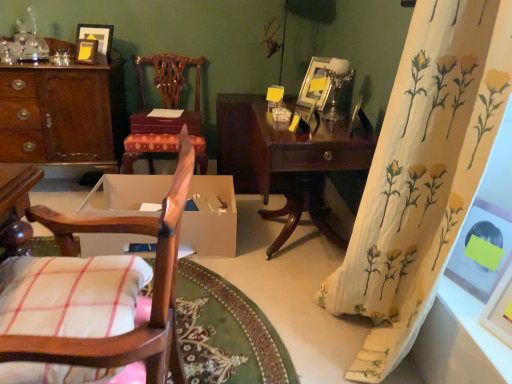
This screenshot has height=384, width=512. Describe the element at coordinates (71, 295) in the screenshot. I see `white cotton pillow at lower left` at that location.

In order to face wooden picture frame at upper left, which is the 2th picture frame from top to bottom, should I rotate leftwards or rightwards?

You should rotate left by 21.160 degrees.

This screenshot has width=512, height=384. I want to click on white cotton pillow at lower left, so click(71, 295).

Does point (74, 292) lie behind point (288, 188)?

That is False.

In the scene shown: Are white cotton pillow at lower left and mahogany wood table at center located far from each other?

Yes, white cotton pillow at lower left and mahogany wood table at center are quite far apart.

Would you say white cotton pillow at lower left is outside mahogany wood table at center?

Indeed, white cotton pillow at lower left is completely outside mahogany wood table at center.

You are a GUI agent. You are given a task and a screenshot of the screen. Output one action in this format:
    pyautogui.click(x=<x>, y=<y>)
    Task: Click on the table below the white cotton pillow at lower left (from a real-world perspective)
    The height and width of the screenshot is (384, 512).
    Given the screenshot: What is the action you would take?
    pyautogui.click(x=286, y=160)

Does mahogany wood table at center turn towards wooden chair with carved backrest at center, acting as the first chair starting from the top?

Yes, mahogany wood table at center is aimed at wooden chair with carved backrest at center, acting as the first chair starting from the top.

Is there a large distance between mahogany wood table at center and wooden chair with carved backrest at center, which ranks as the second chair in front-to-back order?

No, mahogany wood table at center is not far from wooden chair with carved backrest at center, which ranks as the second chair in front-to-back order.

From the picture: Which point is more forward, (296, 136) or (160, 88)?

The point (296, 136) is in front.

How different are the orientations of matte yellow picture frame at upper left, which is the fifth picture frame in bottom-to-top order, and white floral fabric curtain at right in degrees?

61.3 degrees.

In the image, there is a matte yellow picture frame at upper left, the 5th picture frame positioned from the right. At what (x,y) coordinates should I click in order to perform the action: click on curtain below it (from the image's perspective). Please return your answer as a coordinate pair (x, y). The height and width of the screenshot is (384, 512). Looking at the image, I should click on (423, 173).

Considering the relative sizes of matte yellow picture frame at upper left, which is the fifth picture frame in bottom-to-top order, and white floral fabric curtain at right in the image provided, is matte yellow picture frame at upper left, which is the fifth picture frame in bottom-to-top order, smaller than white floral fabric curtain at right?

Correct, matte yellow picture frame at upper left, which is the fifth picture frame in bottom-to-top order, occupies less space than white floral fabric curtain at right.

Is mahogany wood table at center aimed at white cardboard box at center?

Yes, mahogany wood table at center is facing white cardboard box at center.

From the image's perspective, which is above, mahogany wood table at center or white cardboard box at center?

From the image's view, mahogany wood table at center is above.

How different are the orientations of mahogany wood table at center and white cardboard box at center in degrees?

90.1 degrees separate the facing orientations of mahogany wood table at center and white cardboard box at center.

Image resolution: width=512 pixels, height=384 pixels. In order to click on table above the white cardboard box at center (from the image's perspective) in this screenshot , I will do `click(286, 160)`.

From the image's perspective, which one is positioned higher, wooden picture frame at upper left, which is the 2th picture frame from top to bottom, or white cotton pillow at lower left?

wooden picture frame at upper left, which is the 2th picture frame from top to bottom.

Locate an element on the screen. pillow located in front of the wooden picture frame at upper left, which is the 2th picture frame in back-to-front order is located at coordinates (71, 295).

Between wooden picture frame at upper left, which is the 2th picture frame in back-to-front order, and white cotton pillow at lower left, which one appears on the right side from the viewer's perspective?

white cotton pillow at lower left.

Is white cotton pillow at lower left a part of wooden picture frame at upper left, placed as the 4th picture frame when sorted from right to left?

No, white cotton pillow at lower left is located outside of wooden picture frame at upper left, placed as the 4th picture frame when sorted from right to left.

Locate an element on the screen. This screenshot has height=384, width=512. chair that is the 1st object directly below the matte yellow picture frame at right, the 2th picture frame in the front-to-back sequence (from a real-world perspective) is located at coordinates (165, 108).

Would you say matte yellow picture frame at right, the 2th picture frame in the front-to-back sequence, is inside or outside wooden chair with carved backrest at center, which ranks as the second chair in front-to-back order?

matte yellow picture frame at right, the 2th picture frame in the front-to-back sequence, is outside wooden chair with carved backrest at center, which ranks as the second chair in front-to-back order.

Is matte yellow picture frame at right, the fourth picture frame positioned from the back, wider or thinner than wooden chair with carved backrest at center, which ranks as the second chair in front-to-back order?

In the image, matte yellow picture frame at right, the fourth picture frame positioned from the back, appears to be more narrow than wooden chair with carved backrest at center, which ranks as the second chair in front-to-back order.

Is matte yellow picture frame at right, the fourth picture frame in the left-to-right sequence, facing towards wooden chair with carved backrest at center, marked as the second chair in a bottom-to-top arrangement?

No, matte yellow picture frame at right, the fourth picture frame in the left-to-right sequence, is not turned towards wooden chair with carved backrest at center, marked as the second chair in a bottom-to-top arrangement.

Can you confirm if metallic silver picture frame at upper right, the third picture frame when ordered from bottom to top, is positioned to the left of white cotton pillow at lower left?

Incorrect, metallic silver picture frame at upper right, the third picture frame when ordered from bottom to top, is not on the left side of white cotton pillow at lower left.

Consider the image. Considering the relative sizes of metallic silver picture frame at upper right, the third picture frame from the top, and white cotton pillow at lower left in the image provided, is metallic silver picture frame at upper right, the third picture frame from the top, thinner than white cotton pillow at lower left?

Correct, the width of metallic silver picture frame at upper right, the third picture frame from the top, is less than that of white cotton pillow at lower left.

How different are the orientations of metallic silver picture frame at upper right, which appears as the third picture frame when viewed from the right, and white cotton pillow at lower left in degrees?

metallic silver picture frame at upper right, which appears as the third picture frame when viewed from the right, and white cotton pillow at lower left are facing 28.1 degrees away from each other.

Does metallic silver picture frame at upper right, the third picture frame when ordered from bottom to top, touch white cotton pillow at lower left?

They are not placed beside each other.

Locate an element on the screen. pillow in front of the mahogany wood table at center is located at coordinates 71,295.

Where is `the 2nd chair to the left of the mahogany wood table at center, counting from the anchor's position`? This screenshot has width=512, height=384. the 2nd chair to the left of the mahogany wood table at center, counting from the anchor's position is located at coordinates (165, 108).

Based on their spatial positions, is wooden picture frame at upper left, the fourth picture frame positioned from the front, or wooden chair with checkered cushion at left, which is the second chair in back-to-front order, further from white cardboard box at center?

Based on the image, wooden chair with checkered cushion at left, which is the second chair in back-to-front order, appears to be further to white cardboard box at center.

Based on the photo, from the image, which object appears to be nearer to matte yellow picture frame at upper left, positioned as the first picture frame in top-to-bottom order, white cotton pillow at lower left or wooden picture frame at upper left, the fourth picture frame positioned from the front?

wooden picture frame at upper left, the fourth picture frame positioned from the front, is closer to matte yellow picture frame at upper left, positioned as the first picture frame in top-to-bottom order.

From the image, which object appears to be nearer to wooden desk at left, white cotton pillow at lower left or matte white picture frame at right, placed as the 5th picture frame when sorted from back to front?

white cotton pillow at lower left is positioned closer to the anchor wooden desk at left.

Based on the photo, from the image, which object appears to be farther from matte yellow picture frame at upper left, which is the fifth picture frame in bottom-to-top order, metallic silver picture frame at upper right, the third picture frame viewed from the left, or matte white picture frame at right, positioned as the fifth picture frame in left-to-right order?

matte white picture frame at right, positioned as the fifth picture frame in left-to-right order, is further to matte yellow picture frame at upper left, which is the fifth picture frame in bottom-to-top order.

Looking at the image, which one is located closer to wooden picture frame at upper left, the fourth picture frame positioned from the front, metallic silver picture frame at upper right, which appears as the third picture frame when viewed from the front, or mahogany wood table at center?

mahogany wood table at center is closer to wooden picture frame at upper left, the fourth picture frame positioned from the front.

Looking at the image, which one is located closer to mahogany wood table at center, metallic silver table lamp at upper right or matte white picture frame at right, the 1th picture frame ordered from the bottom?

Based on the image, metallic silver table lamp at upper right appears to be nearer to mahogany wood table at center.

Based on their spatial positions, is wooden chair with carved backrest at center, marked as the second chair in a bottom-to-top arrangement, or metallic silver picture frame at upper right, the third picture frame from the top, closer to matte yellow picture frame at right, marked as the 2th picture frame in a bottom-to-top arrangement?

metallic silver picture frame at upper right, the third picture frame from the top.

When comparing their distances from wooden chair with checkered cushion at left, positioned as the 2th chair in top-to-bottom order, does white cardboard box at center or white cotton pillow at lower left seem closer?

Based on the image, white cotton pillow at lower left appears to be nearer to wooden chair with checkered cushion at left, positioned as the 2th chair in top-to-bottom order.

Find the location of `table lamp between wooden picture frame at upper left, the fourth picture frame positioned from the front, and matte yellow picture frame at right, the fourth picture frame in the left-to-right sequence`. table lamp between wooden picture frame at upper left, the fourth picture frame positioned from the front, and matte yellow picture frame at right, the fourth picture frame in the left-to-right sequence is located at coordinates (337, 83).

This screenshot has width=512, height=384. Identify the location of table between wooden chair with checkered cushion at left, the 1th chair from the front, and metallic silver picture frame at upper right, the 3th picture frame positioned from the back, in the front-back direction. (286, 160).

This screenshot has height=384, width=512. What are the coordinates of `table situated between white cardboard box at center and matte yellow picture frame at right, the 2th picture frame in the front-to-back sequence, from left to right` in the screenshot? It's located at (286, 160).

Identify the location of table lamp between matte yellow picture frame at upper left, which is the 5th picture frame from front to back, and matte white picture frame at right, the first picture frame when ordered from right to left, from left to right. This screenshot has height=384, width=512. (337, 83).